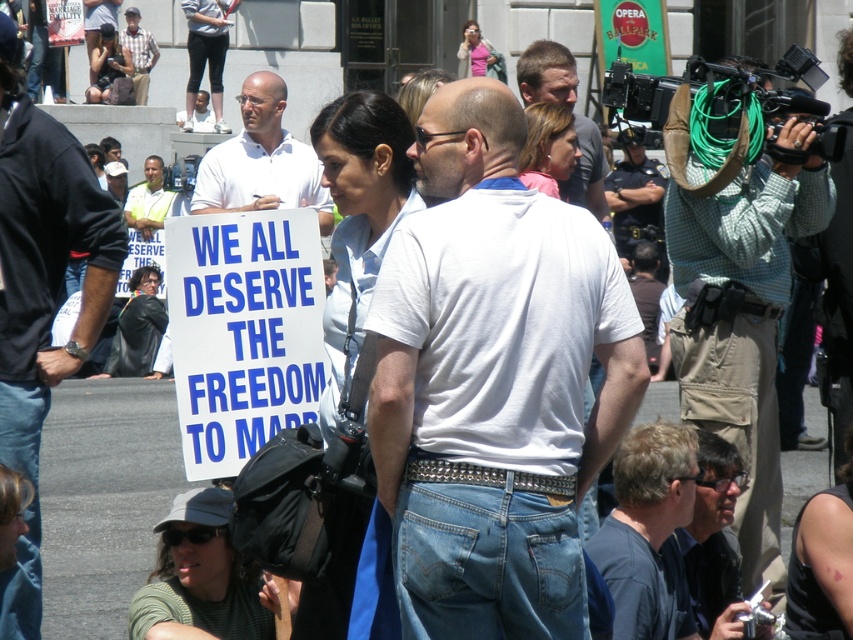
Is dark blue shirt at center above plaid shirt at upper left?

No, dark blue shirt at center is not above plaid shirt at upper left.

In the scene shown: Who is taller, dark blue shirt at center or plaid shirt at upper left?

dark blue shirt at center is taller.

What do you see at coordinates (648, 532) in the screenshot?
I see `dark blue shirt at center` at bounding box center [648, 532].

This screenshot has width=853, height=640. Identify the location of dark blue shirt at center. (648, 532).

Does point (490, 209) lie behind point (674, 604)?

No, (490, 209) is in front of (674, 604).

Between point (521, 589) and point (643, 563), which one is positioned in front?

Point (521, 589)

This screenshot has height=640, width=853. Find the location of `white cotton t-shirt at center`. white cotton t-shirt at center is located at coordinates (492, 380).

Locate an element on the screen. white cotton t-shirt at center is located at coordinates (492, 380).

Is light brown leather jacket at upper center positioned at the back of uniformed officer at upper right?

No, light brown leather jacket at upper center is in front of uniformed officer at upper right.

Does light brown leather jacket at upper center have a lesser width compared to uniformed officer at upper right?

Correct, light brown leather jacket at upper center's width is less than uniformed officer at upper right's.

Which is in front, point (596, 189) or point (625, 253)?

Point (596, 189) is more forward.

Where is `light brown leather jacket at upper center`? The height and width of the screenshot is (640, 853). light brown leather jacket at upper center is located at coordinates pyautogui.click(x=547, y=74).